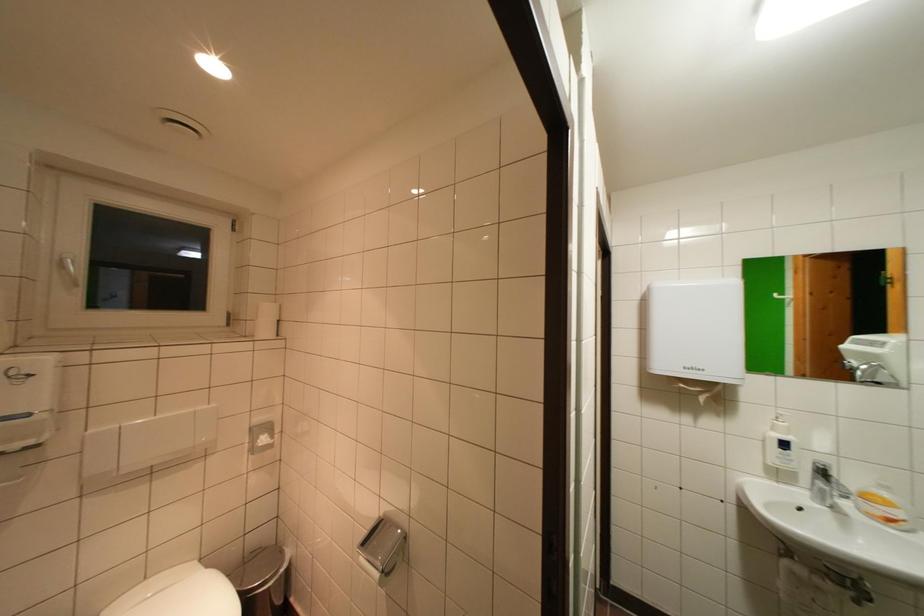
This screenshot has height=616, width=924. Describe the element at coordinates (823, 459) in the screenshot. I see `the metal faucet handle` at that location.